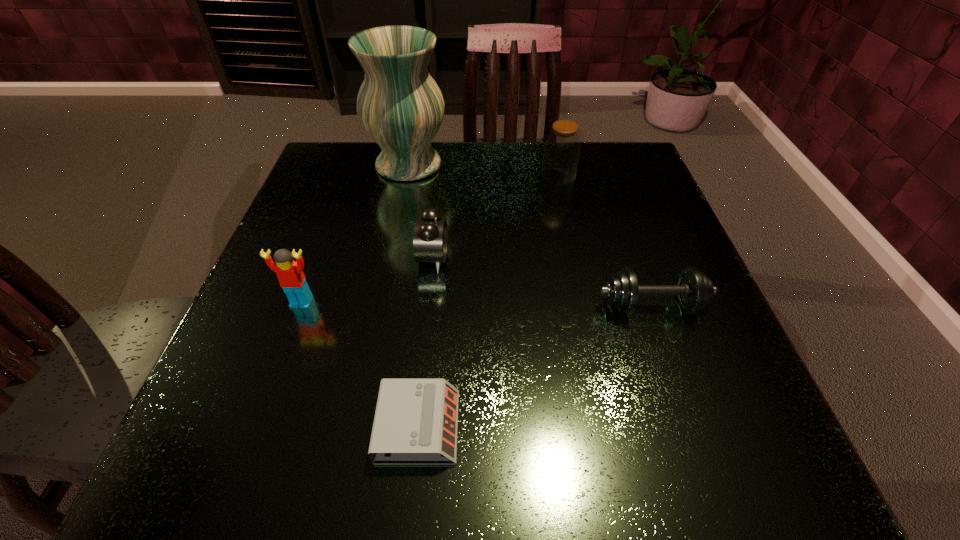
Identify the location of vacant position located on the face of the Lego. The width and height of the screenshot is (960, 540). (291, 333).

This screenshot has height=540, width=960. What are the coordinates of `vacant space located on the front side of the taller alarm clock` in the screenshot? It's located at (474, 259).

Image resolution: width=960 pixels, height=540 pixels. I want to click on free space located on the back of the dumbbell, so click(611, 187).

Locate an element on the screen. This screenshot has height=540, width=960. vacant space situated 0.380m on the right of the nearer alarm clock is located at coordinates (737, 427).

Locate an element on the screen. Image resolution: width=960 pixels, height=540 pixels. vase that is at the far edge is located at coordinates (401, 107).

Identify the location of jar that is at the far edge. The width and height of the screenshot is (960, 540). (562, 146).

Where is `object at the near edge`? This screenshot has height=540, width=960. object at the near edge is located at coordinates (416, 420).

Where is `vase positioned at the left edge`? The height and width of the screenshot is (540, 960). vase positioned at the left edge is located at coordinates (401, 107).

Identify the location of Lego that is at the left edge. (290, 274).

Where is `object positioned at the right edge`? object positioned at the right edge is located at coordinates (694, 290).